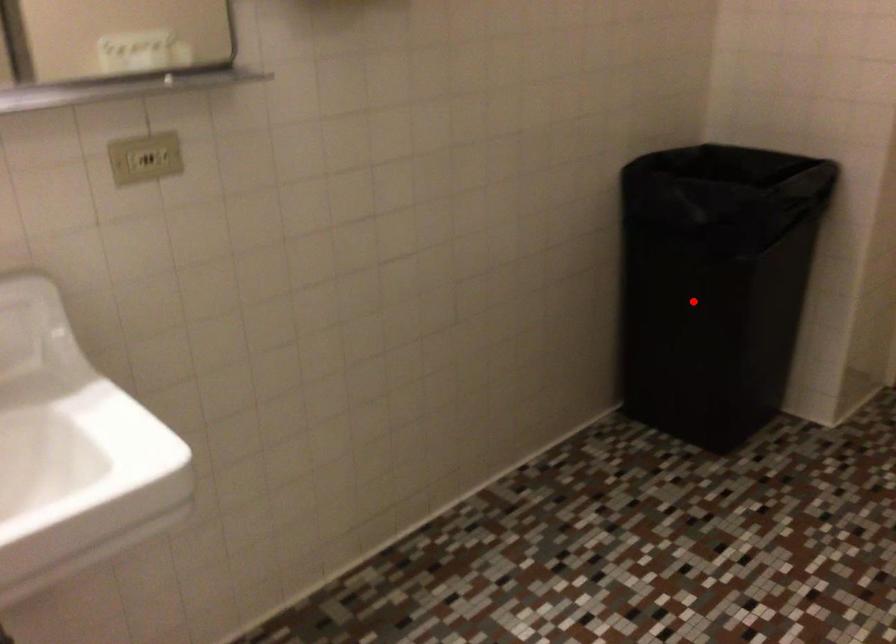
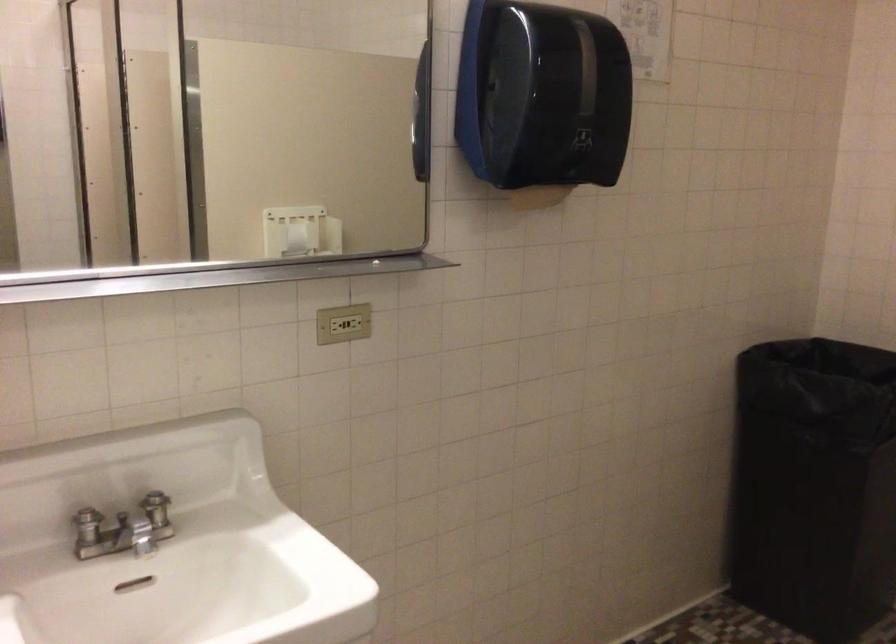
The point at the highlighted location is marked in the first image. Where is the corresponding point in the second image?

(814, 486)